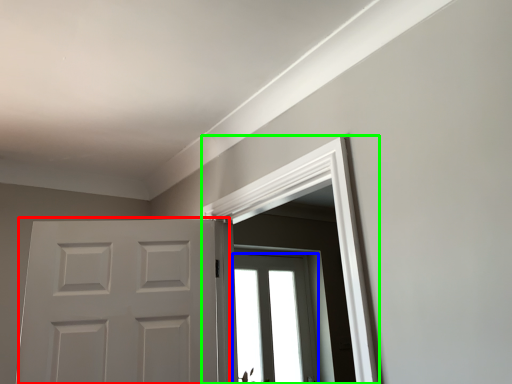
Question: Considering the real-world distances, which object is closest to door (highlighted by a red box)? window (highlighted by a blue box) or window frame (highlighted by a green box).

Choices:
 (A) window
 (B) window frame

Answer: (B)